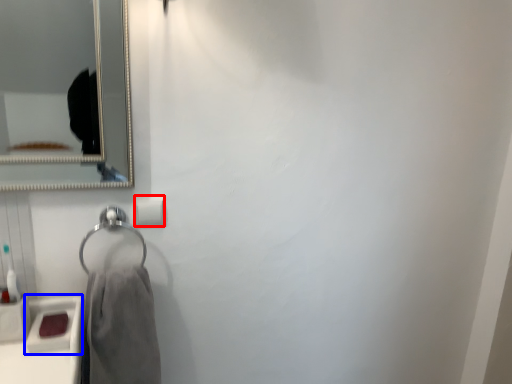
Question: Which point is further to the camera, toilet paper (highlighted by a red box) or sink (highlighted by a blue box)?

Choices:
 (A) toilet paper
 (B) sink

Answer: (A)